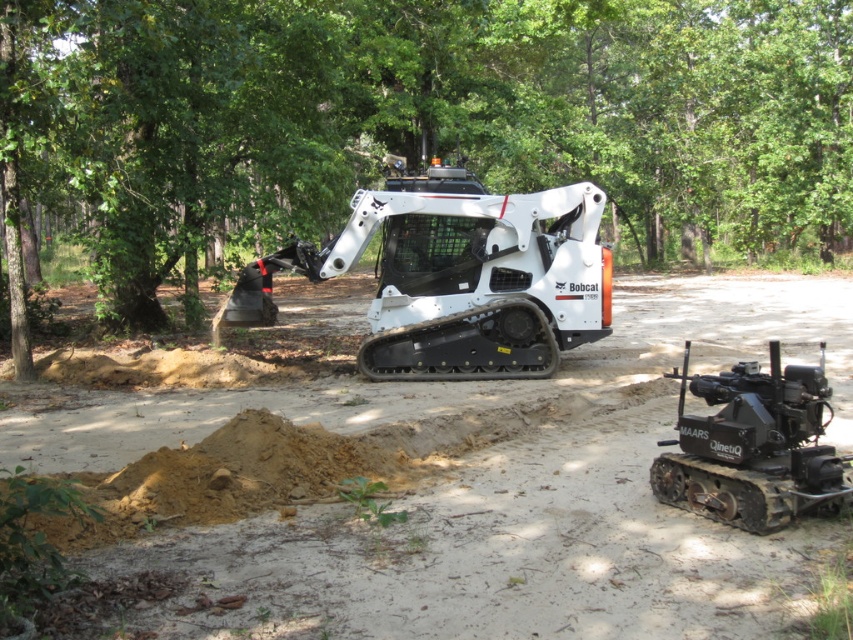
Can you confirm if brown sandy soil at center is bigger than black rubber tracked vehicle at lower right?

Yes, brown sandy soil at center is bigger than black rubber tracked vehicle at lower right.

Locate an element on the screen. brown sandy soil at center is located at coordinates (492, 490).

Find the location of `brown sandy soil at center`. brown sandy soil at center is located at coordinates (492, 490).

Can you confirm if green leafy tree at upper center is smaller than brown sandy soil at center?

Incorrect, green leafy tree at upper center is not smaller in size than brown sandy soil at center.

Does green leafy tree at upper center have a greater width compared to brown sandy soil at center?

Yes, green leafy tree at upper center is wider than brown sandy soil at center.

The image size is (853, 640). In order to click on green leafy tree at upper center in this screenshot , I will do `click(421, 120)`.

This screenshot has height=640, width=853. I want to click on green leafy tree at upper center, so click(421, 120).

Between white matte bobcat at center and black rubber tracked vehicle at lower right, which one appears on the left side from the viewer's perspective?

white matte bobcat at center is more to the left.

Who is higher up, white matte bobcat at center or black rubber tracked vehicle at lower right?

Positioned higher is white matte bobcat at center.

Identify the location of white matte bobcat at center. (457, 276).